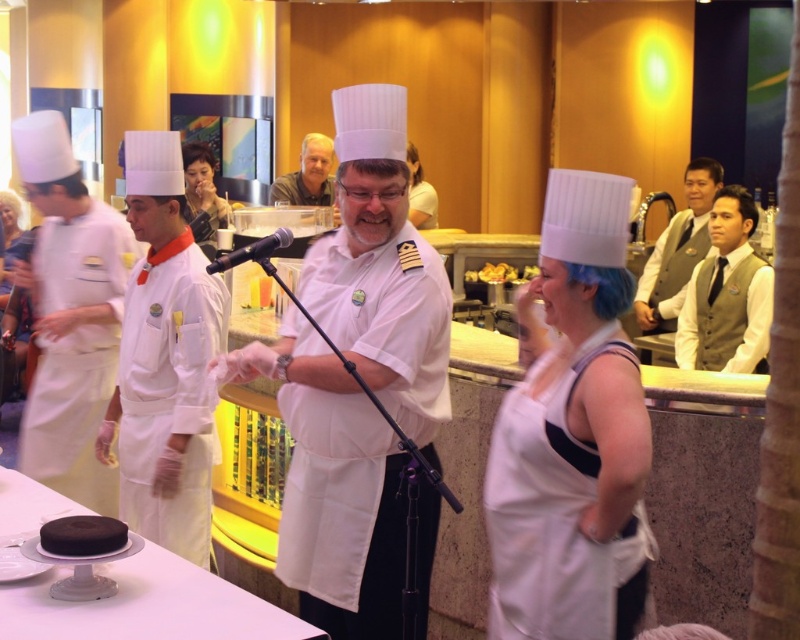
How far apart are white fabric chef's coat at left and black matte microphone at center?

The distance of white fabric chef's coat at left from black matte microphone at center is 2.10 meters.

Can you confirm if white fabric chef's coat at left is positioned to the right of black matte microphone at center?

In fact, white fabric chef's coat at left is to the left of black matte microphone at center.

At what (x,y) coordinates should I click in order to perform the action: click on white fabric chef's coat at left. Please return your answer as a coordinate pair (x, y). The image size is (800, 640). Looking at the image, I should click on (74, 346).

This screenshot has height=640, width=800. I want to click on white fabric chef's coat at left, so click(74, 346).

Does white matte apron at center appear on the right side of smooth skin face at center?

Indeed, white matte apron at center is positioned on the right side of smooth skin face at center.

Who is more forward, (624, 340) or (200, 195)?

Positioned in front is point (624, 340).

Which is in front, point (516, 516) or point (214, 189)?

Positioned in front is point (516, 516).

Where is `white matte apron at center`? The image size is (800, 640). white matte apron at center is located at coordinates (574, 436).

Is white matte chef hat at center positioned at the back of light brown vest at right?

No, it is not.

The width and height of the screenshot is (800, 640). I want to click on white matte chef hat at center, so click(x=342, y=493).